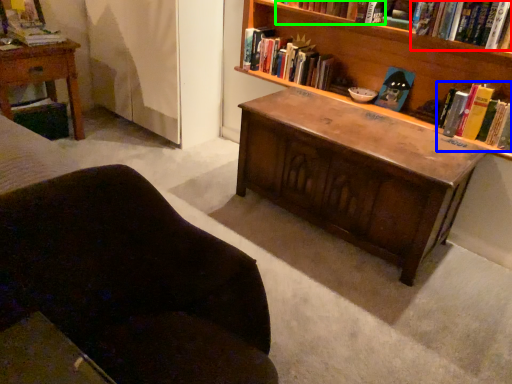
Question: Which object is positioned farthest from book (highlighted by a red box)? Select from book (highlighted by a blue box) and book (highlighted by a green box).

Choices:
 (A) book
 (B) book

Answer: (B)